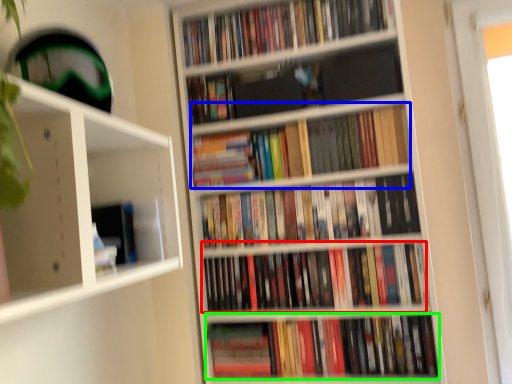
Question: Based on their relative distances, which object is farther from book (highlighted by a red box)? Choose from book (highlighted by a blue box) and book (highlighted by a green box).

Choices:
 (A) book
 (B) book

Answer: (A)